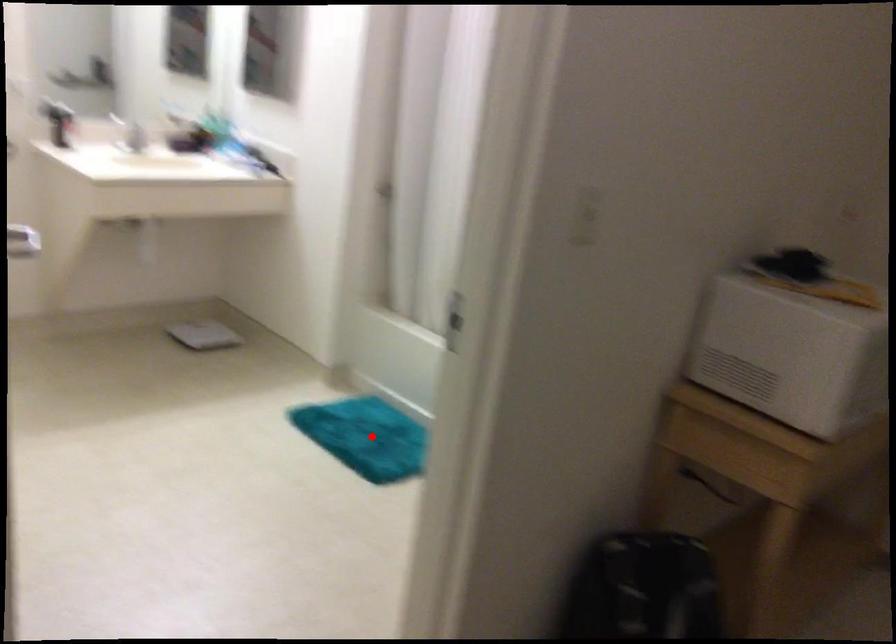
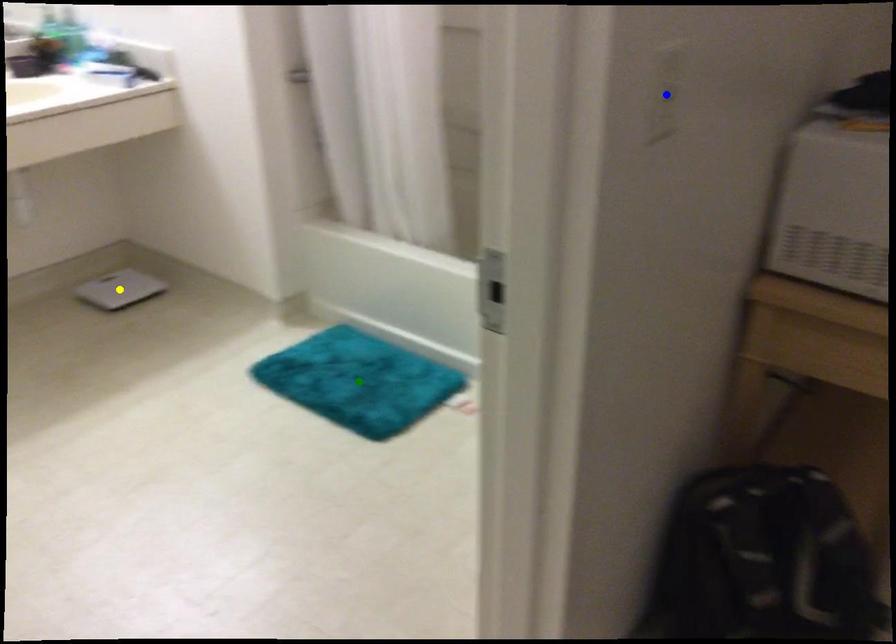
Question: I am providing you with two images of the same scene from different viewpoints. A red point is marked on the first image. You are given multiple points on the second image. In image 2, which mark is for the same physical point as the one in image 1?

Choices:
 (A) yellow point
 (B) blue point
 (C) green point

Answer: (C)